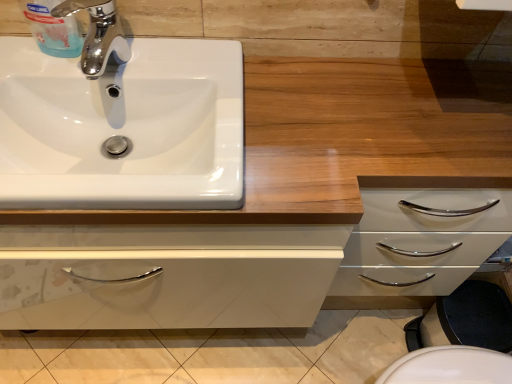
Question: Is white glossy sink at upper left turned away from wooden counter at upper center?

Choices:
 (A) no
 (B) yes

Answer: (B)

Question: Does white glossy sink at upper left lie behind wooden counter at upper center?

Choices:
 (A) yes
 (B) no

Answer: (A)

Question: Can you confirm if white glossy sink at upper left is wider than wooden counter at upper center?

Choices:
 (A) yes
 (B) no

Answer: (B)

Question: Is white glossy sink at upper left bigger than wooden counter at upper center?

Choices:
 (A) no
 (B) yes

Answer: (A)

Question: Is there a large distance between white glossy sink at upper left and wooden counter at upper center?

Choices:
 (A) no
 (B) yes

Answer: (A)

Question: Does white glossy sink at upper left touch wooden counter at upper center?

Choices:
 (A) no
 (B) yes

Answer: (A)

Question: Does chrome/metallic faucet at upper left have a larger size compared to wooden counter at upper center?

Choices:
 (A) yes
 (B) no

Answer: (B)

Question: Is chrome/metallic faucet at upper left taller than wooden counter at upper center?

Choices:
 (A) no
 (B) yes

Answer: (A)

Question: Is chrome/metallic faucet at upper left oriented towards wooden counter at upper center?

Choices:
 (A) yes
 (B) no

Answer: (B)

Question: From the image's perspective, is chrome/metallic faucet at upper left above wooden counter at upper center?

Choices:
 (A) yes
 (B) no

Answer: (A)

Question: Are chrome/metallic faucet at upper left and wooden counter at upper center beside each other?

Choices:
 (A) yes
 (B) no

Answer: (B)

Question: Considering the relative positions of chrome/metallic faucet at upper left and wooden counter at upper center in the image provided, is chrome/metallic faucet at upper left in front of wooden counter at upper center?

Choices:
 (A) no
 (B) yes

Answer: (A)

Question: Is white glossy sink at upper left shorter than chrome/metallic faucet at upper left?

Choices:
 (A) yes
 (B) no

Answer: (A)